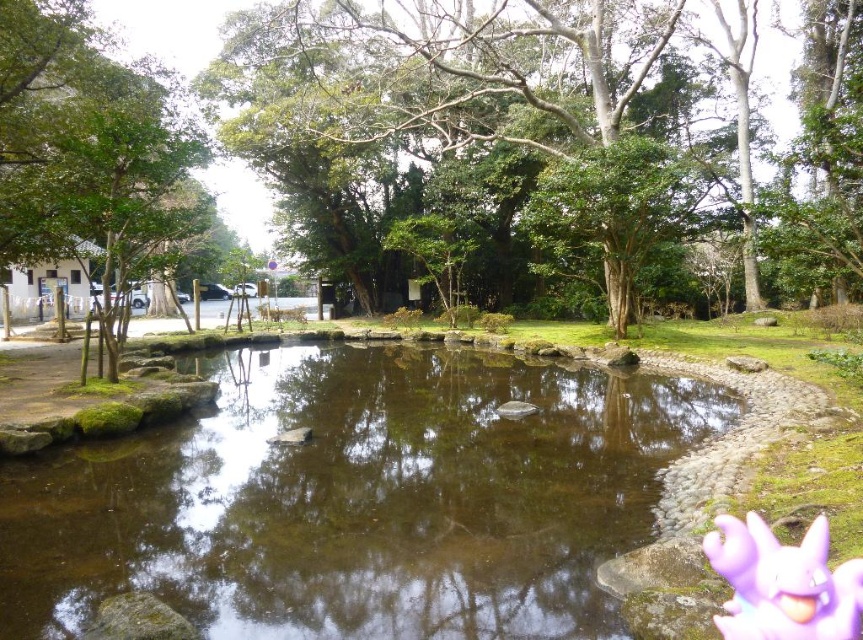
Is clear water at center above green leafy tree at center?

No.

Between clear water at center and green leafy tree at center, which one appears on the left side from the viewer's perspective?

clear water at center

Where is `clear water at center`? This screenshot has width=863, height=640. clear water at center is located at coordinates (358, 499).